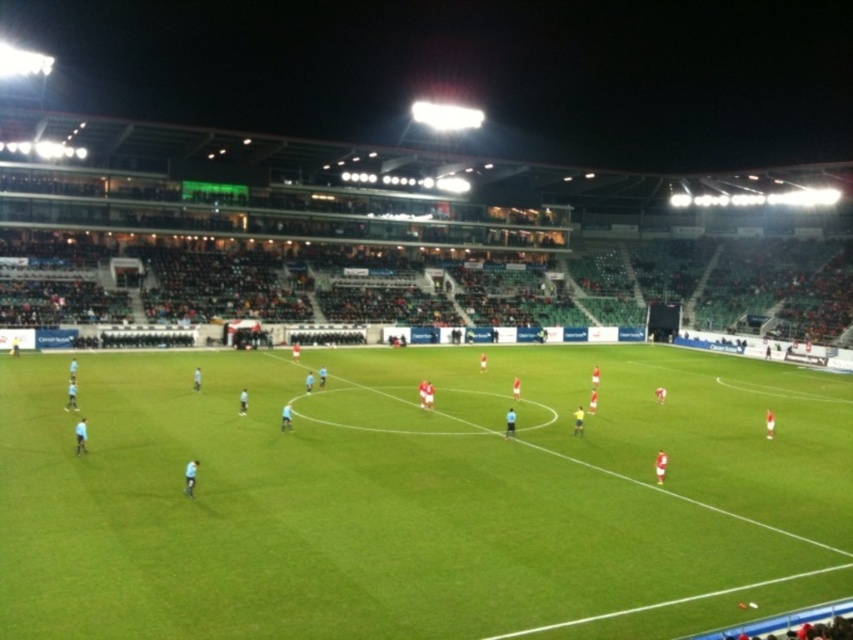
You are a spectator sitting in the lower section of the stadium. You want to throw a water bottle to a friend who is standing on the green grass football field at center. If your throwing range is 15 meters, can you reach them?

The green grass football field at center is 13.58 meters away from the viewer, so yes, you can reach them as the distance is within your 15 meters throwing range.

You are a drone operator trying to capture aerial shots of the soccer match. You have two points marked on your screen for camera positioning. The first point is labeled as point (773,538) and the second is point (498,545). Which point is closer to the camera lens?

Point (498,545) is closer to the camera lens because the description states that point (773,538) is further away from the viewer compared to point (498,545).

You are a photographer standing at the camera position. You want to capture a photo of the point at coordinate point (442, 410). The stadium has a minimum focus distance of 30 meters. Will the camera be able to focus on the point?

The point at coordinate point (442, 410) is 35.19 meters away from the camera. Since the minimum focus distance is 30 meters, the camera can focus on the point as it is beyond the minimum required distance.